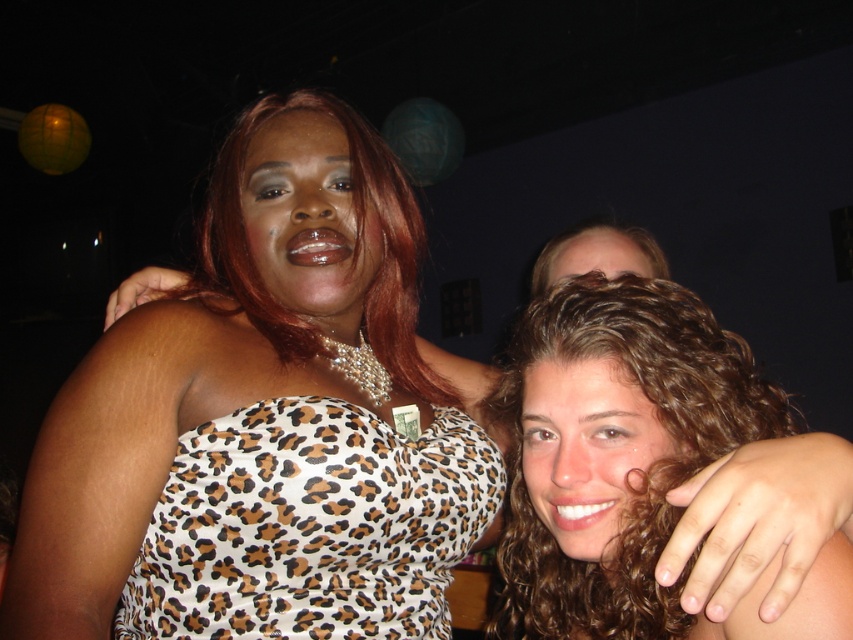
Is curly hair at center in front of smooth skin face at upper center?

Yes, curly hair at center is closer to the viewer.

The height and width of the screenshot is (640, 853). What do you see at coordinates (585, 451) in the screenshot?
I see `curly hair at center` at bounding box center [585, 451].

Identify the location of curly hair at center. (585, 451).

Who is shorter, matte leopard print top at center or curly hair at center?

curly hair at center

Which is more to the left, matte leopard print top at center or curly hair at center?

Positioned to the left is matte leopard print top at center.

The image size is (853, 640). Find the location of `matte leopard print top at center`. matte leopard print top at center is located at coordinates (308, 218).

What do you see at coordinates (311, 525) in the screenshot?
I see `leopard print fabric dress at center` at bounding box center [311, 525].

Is the position of leopard print fabric dress at center less distant than that of matte leopard print top at center?

Yes.

Does point (425, 531) come behind point (361, 273)?

No, it is in front of (361, 273).

Locate an element on the screen. This screenshot has height=640, width=853. leopard print fabric dress at center is located at coordinates (311, 525).